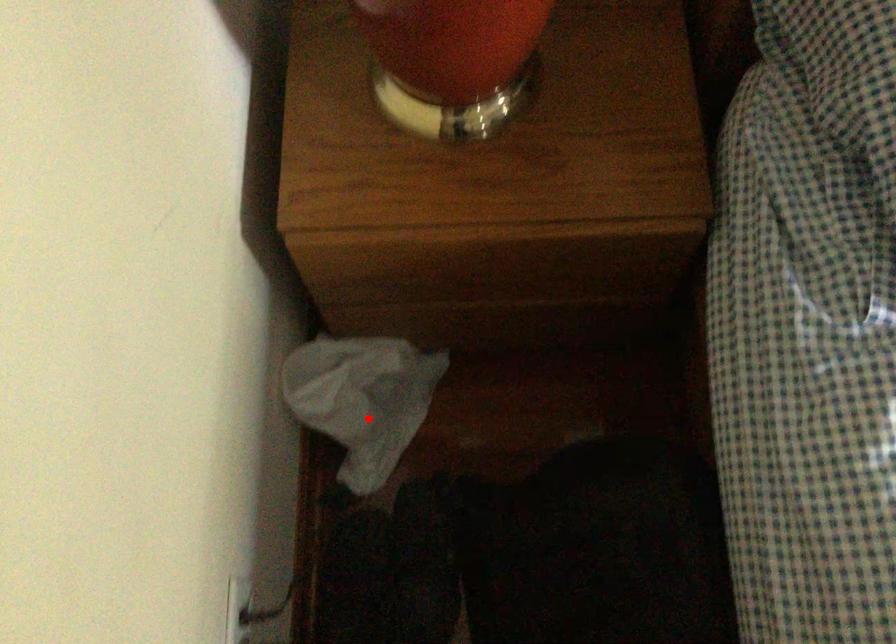
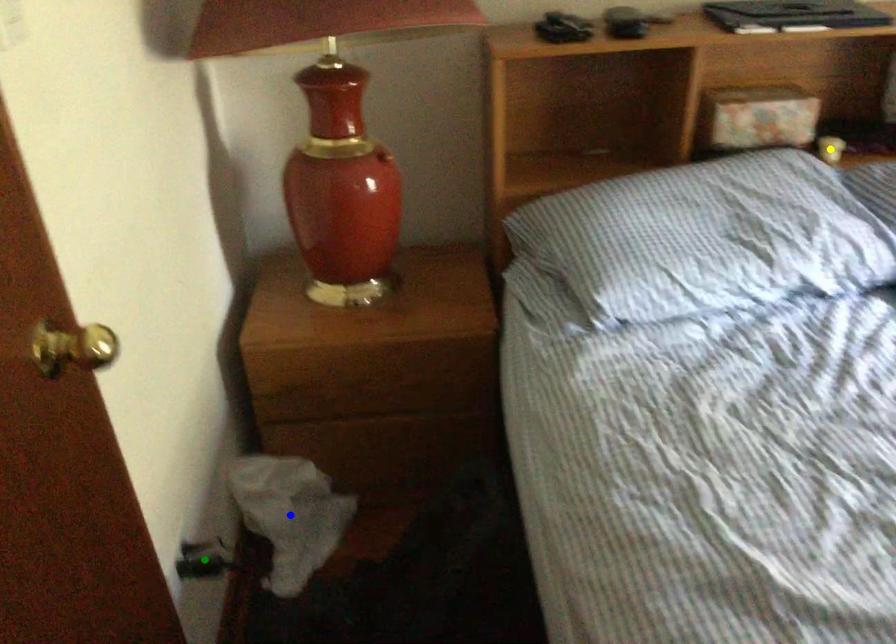
Question: I am providing you with two images of the same scene from different viewpoints. A red point is marked on the first image. You are given multiple points on the second image. Which mark in image 2 goes with the point in image 1?

Choices:
 (A) green point
 (B) blue point
 (C) yellow point

Answer: (B)